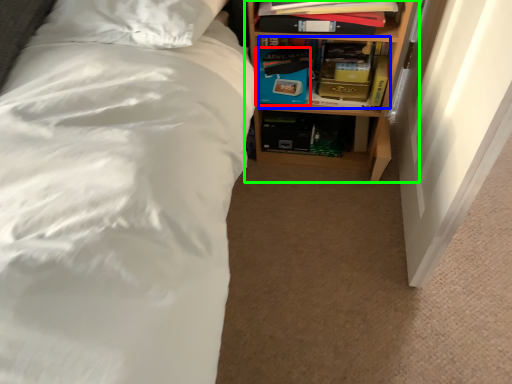
Question: Estimate the real-world distances between objects in this image. Which object is farther from box (highlighted by a red box), book (highlighted by a blue box) or shelf (highlighted by a green box)?

Choices:
 (A) book
 (B) shelf

Answer: (B)